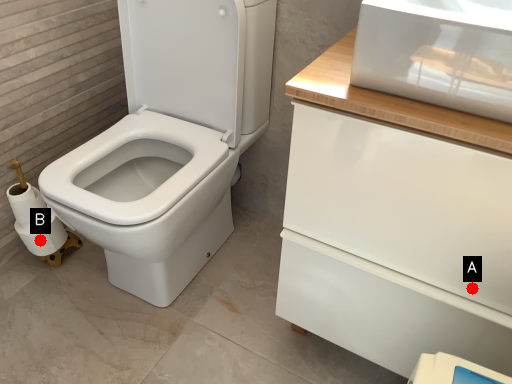
Question: Two points are circled on the image, labeled by A and B beside each circle. Which of the following is the farthest from the observer?

Choices:
 (A) A is further
 (B) B is further

Answer: (B)